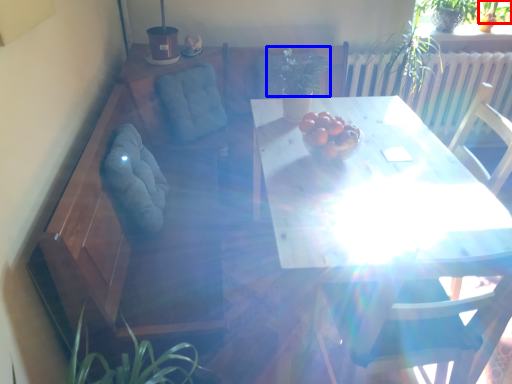
Question: Which of the following is the farthest to the observer, plant (highlighted by a red box) or plant (highlighted by a blue box)?

Choices:
 (A) plant
 (B) plant

Answer: (A)